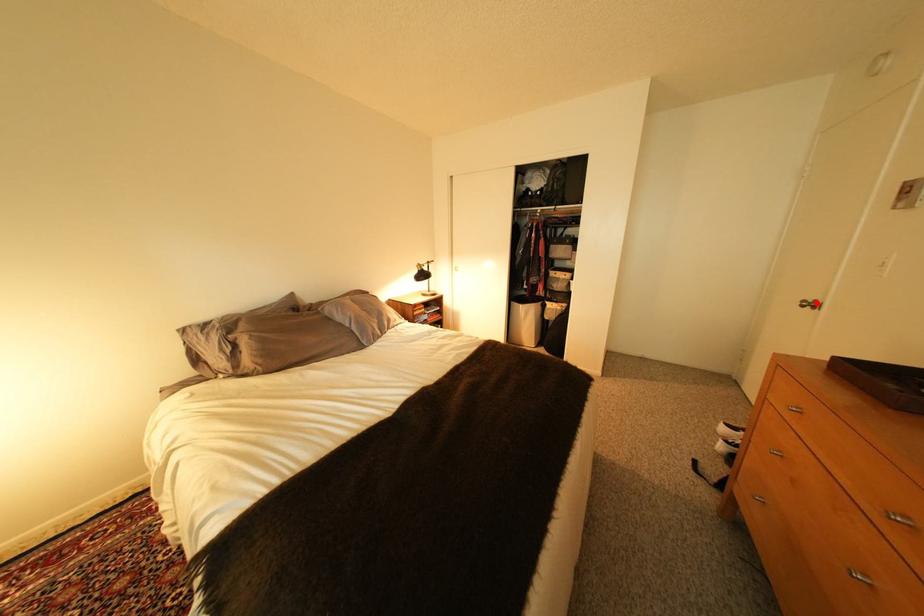
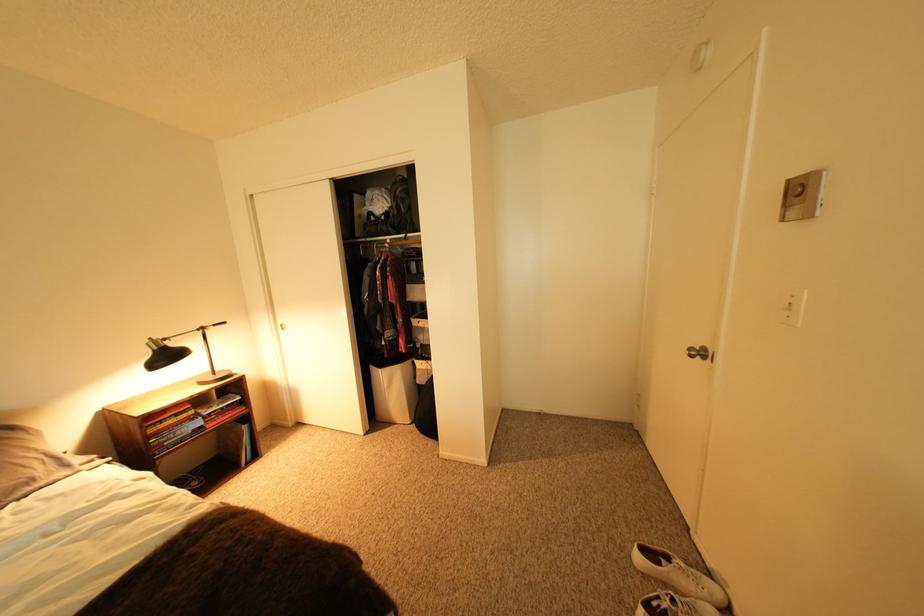
Find the pixel in the second image that matches the highlighted location in the first image.

(703, 351)